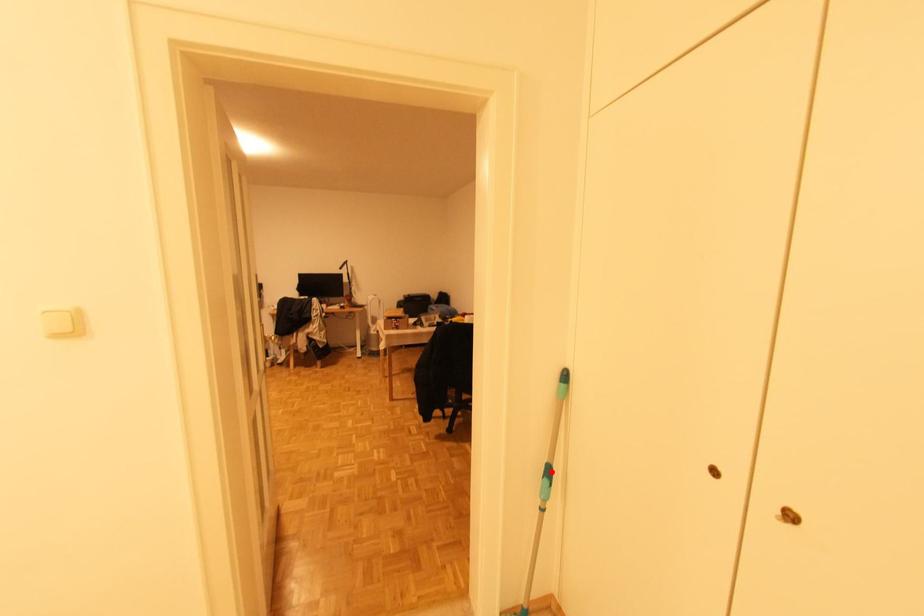
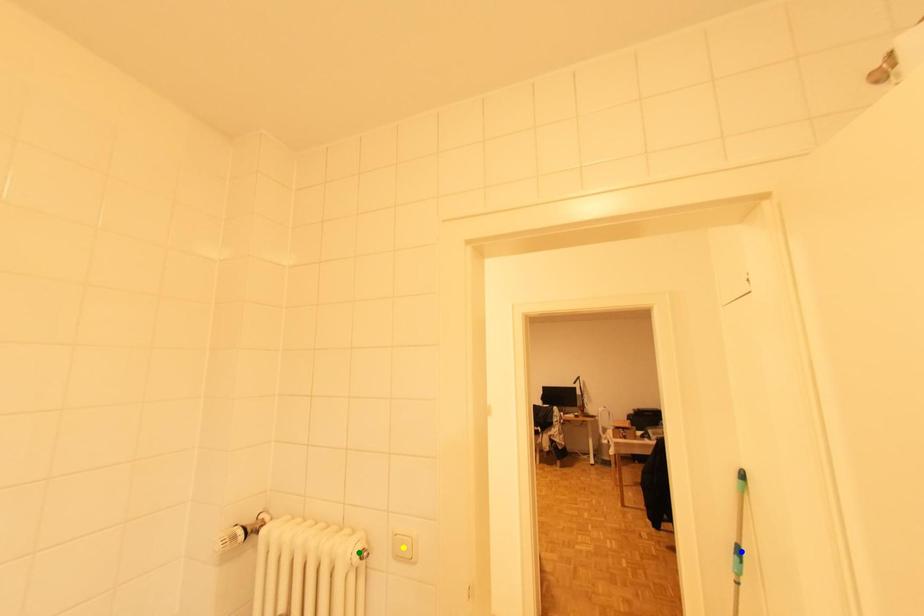
Question: I am providing you with two images of the same scene from different viewpoints. A red point is marked on the first image. You are given multiple points on the second image. Which point in image 2 is actually the same real-world point as the red point in image 1?

Choices:
 (A) blue point
 (B) yellow point
 (C) green point

Answer: (A)